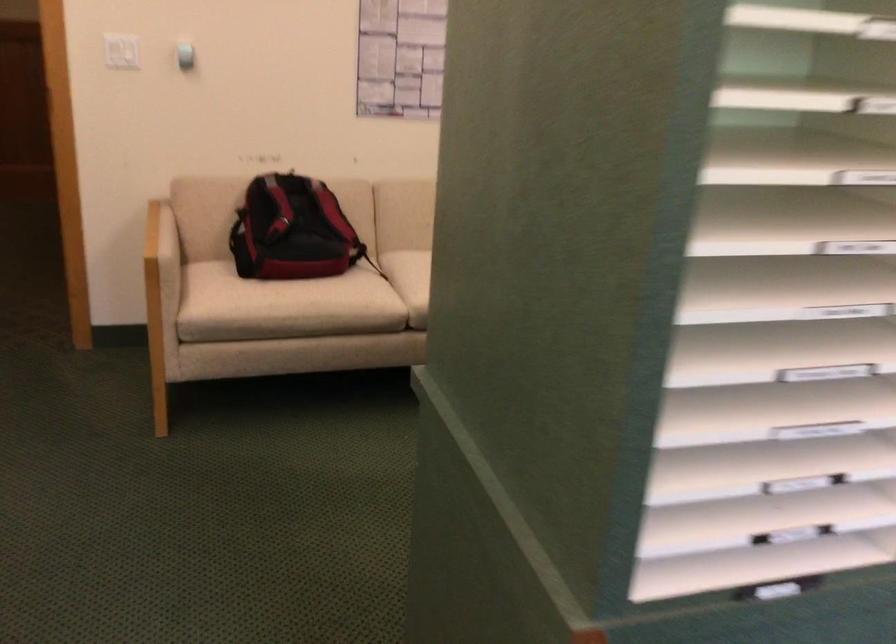
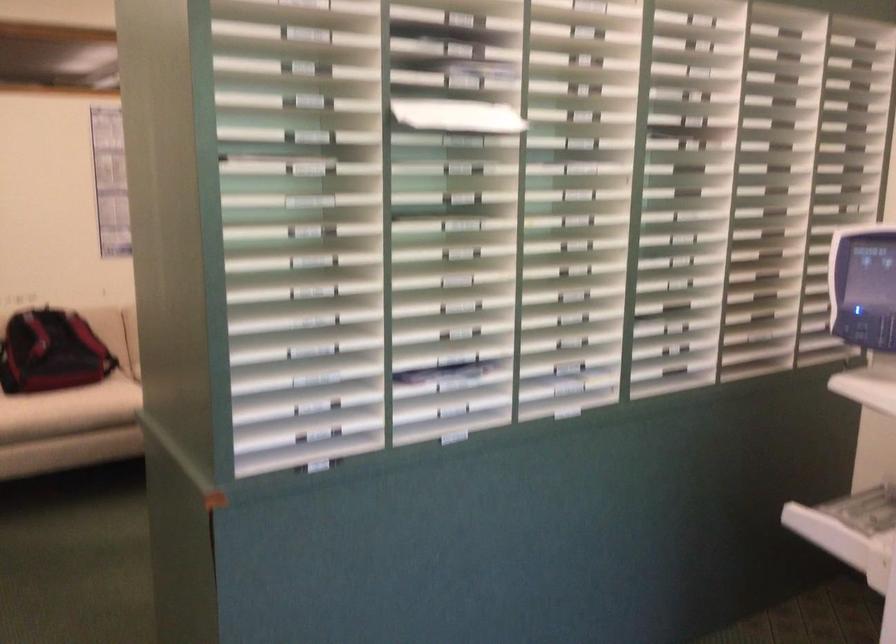
Question: The camera is either moving clockwise (left) or counter-clockwise (right) around the object. The first image is from the beginning of the video and the second image is from the end. Is the camera moving left or right when shooting the video?

Choices:
 (A) Left
 (B) Right

Answer: (A)